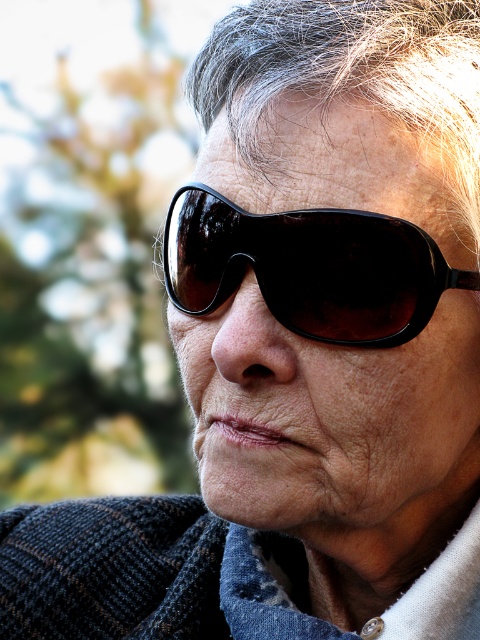
Question: Does faded denim jacket at lower right have a lesser width compared to black plastic sunglasses at center?

Choices:
 (A) no
 (B) yes

Answer: (A)

Question: Does faded denim jacket at lower right appear under black plastic sunglasses at center?

Choices:
 (A) no
 (B) yes

Answer: (B)

Question: Can you confirm if faded denim jacket at lower right is bigger than black plastic sunglasses at center?

Choices:
 (A) no
 (B) yes

Answer: (B)

Question: Which point is farther to the camera?

Choices:
 (A) (151, 522)
 (B) (230, 280)

Answer: (A)

Question: Which of the following is the closest to the observer?

Choices:
 (A) (296, 564)
 (B) (309, 324)

Answer: (B)